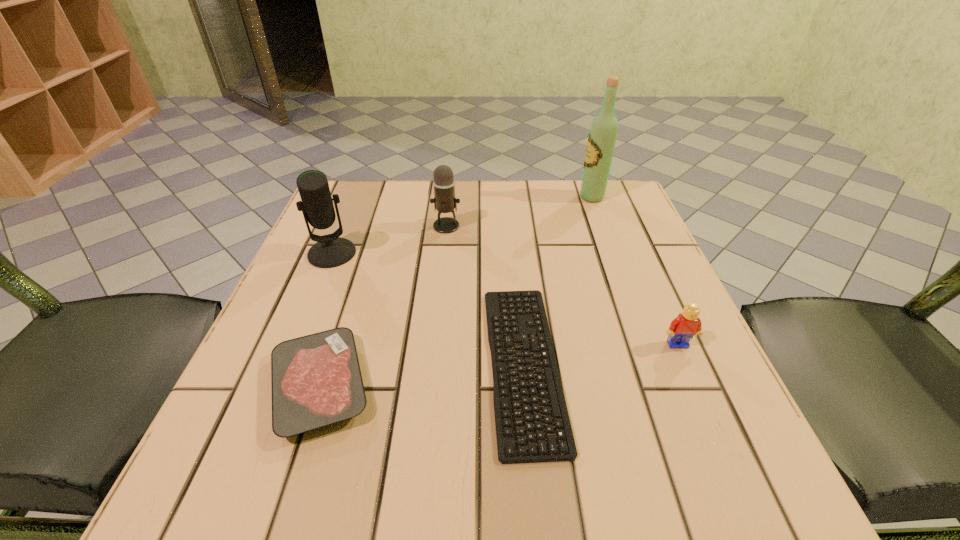
You are a GUI agent. You are given a task and a screenshot of the screen. Output one action in this format:
    pyautogui.click(x=<x>, y=<y>)
    Task: Click on the steak that is at the near edge
    Image resolution: width=960 pixels, height=540 pixels.
    Given the screenshot: What is the action you would take?
    pyautogui.click(x=316, y=380)

Find the location of a particular element. computer keyboard at the near edge is located at coordinates (506, 445).

Where is `microphone located in the left edge section of the desktop`? microphone located in the left edge section of the desktop is located at coordinates (330, 251).

The height and width of the screenshot is (540, 960). In order to click on steak present at the left edge in this screenshot , I will do `click(316, 380)`.

This screenshot has width=960, height=540. I want to click on wine bottle at the right edge, so click(x=602, y=137).

You are a GUI agent. You are given a task and a screenshot of the screen. Output one action in this format:
    pyautogui.click(x=<x>, y=<y>)
    Task: Click on the Lego located at the right edge
    
    Given the screenshot: What is the action you would take?
    pyautogui.click(x=687, y=324)

Where is `object located in the near left corner section of the desktop`? object located in the near left corner section of the desktop is located at coordinates (316, 380).

What are the coordinates of `object that is positioned at the far right corner` in the screenshot? It's located at (602, 137).

In the image, there is a desktop. Where is `vacant space at the far edge`? vacant space at the far edge is located at coordinates (507, 193).

Locate an element on the screen. This screenshot has width=960, height=540. vacant area at the near edge of the desktop is located at coordinates (457, 470).